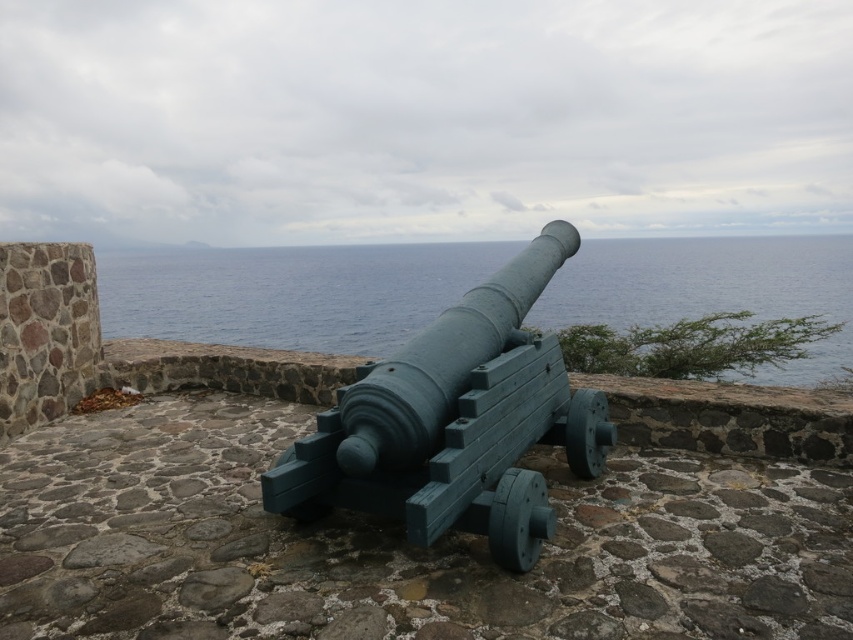
In the scene shown: You are standing at the cannon on the stone platform. Looking towards the point at coordinates (289, 292), what do you see?

At point (289, 292) lies blue water at center.

You are a historian examining two cannons in the image. The green painted wood cannon at center and the teal painted wood cannon at center. Which cannon is positioned in front of the other?

The green painted wood cannon at center is closer to the viewer than the teal painted wood cannon at center, so it is positioned in front of the teal painted wood cannon at center.

You are a historian examining the cannon and the surrounding area. From your vantage point, does the blue water at center appear to be above or below the teal painted wood cannon at center?

The blue water at center is positioned over the teal painted wood cannon at center, so it appears above the cannon.